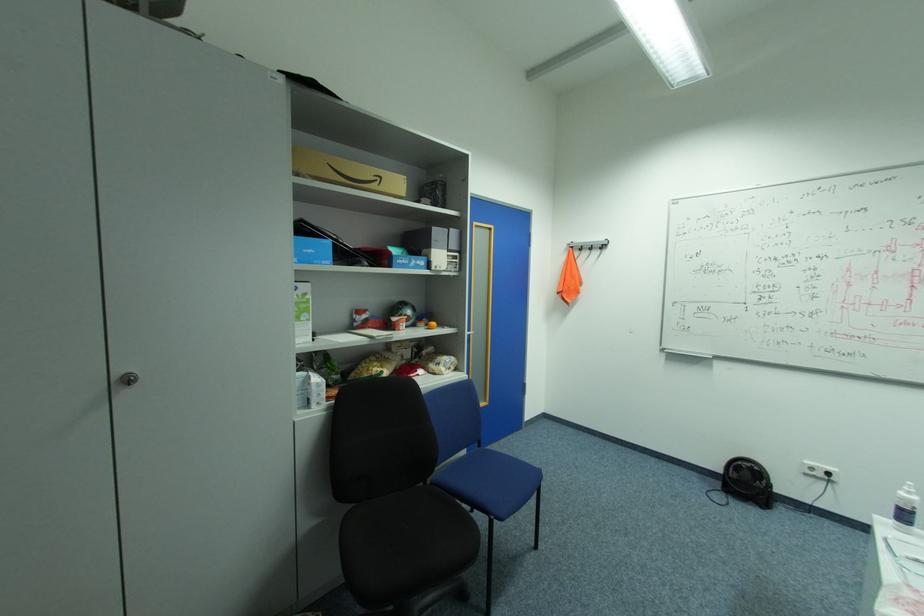
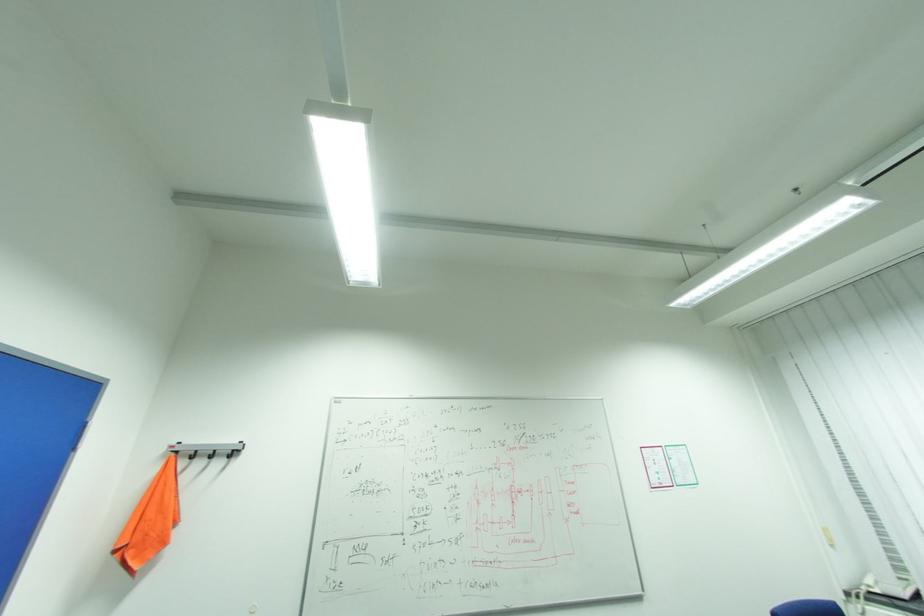
The first image is from the beginning of the video and the second image is from the end. How did the camera likely rotate when shooting the video?

The camera rotated toward right-up.